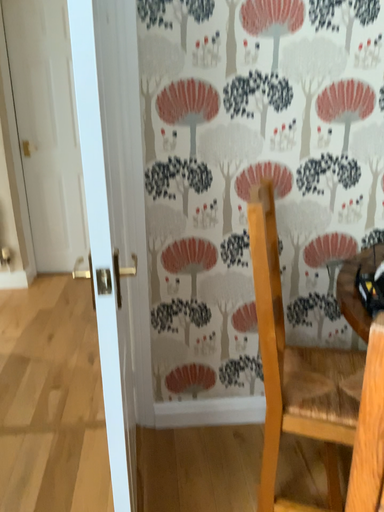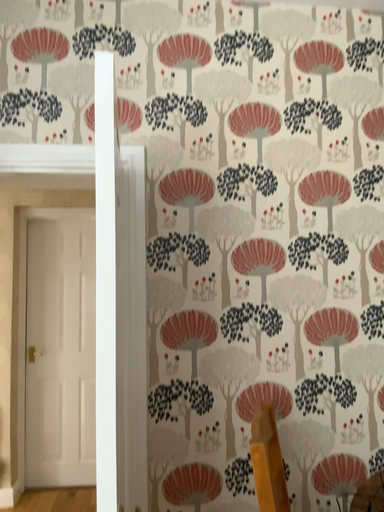
Question: How did the camera likely rotate when shooting the video?

Choices:
 (A) rotated upward
 (B) rotated downward

Answer: (A)